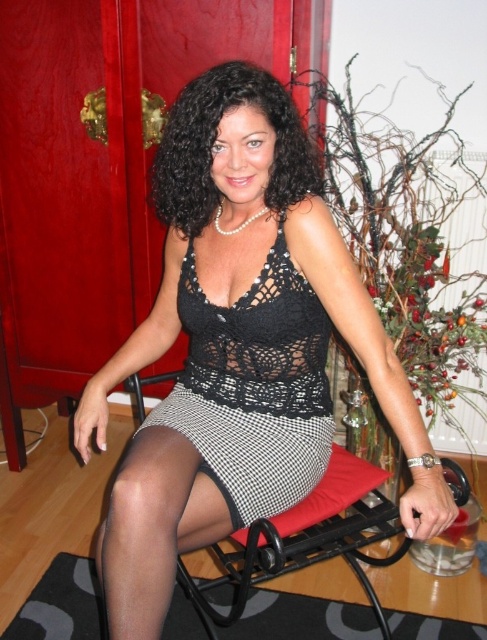
Who is higher up, black lace dress at center or black curly hair at center?

black curly hair at center is above.

What do you see at coordinates (254, 387) in the screenshot? I see `black lace dress at center` at bounding box center [254, 387].

Where is `black lace dress at center`? black lace dress at center is located at coordinates (254, 387).

What do you see at coordinates (300, 618) in the screenshot?
I see `black textured mat at lower left` at bounding box center [300, 618].

Is the position of black textured mat at lower left less distant than that of black houndstooth skirt at center?

That is False.

Between point (262, 618) and point (146, 420), which one is positioned in front?

Point (146, 420) is more forward.

You are a GUI agent. You are given a task and a screenshot of the screen. Output one action in this format:
    pyautogui.click(x=<x>, y=<y>)
    Task: Click on the black textured mat at lower left
    
    Given the screenshot: What is the action you would take?
    pyautogui.click(x=300, y=618)

Which is behind, point (336, 250) or point (294, 131)?

The point (336, 250) is more distant.

Is black lace top at center smaller than black curly hair at center?

No.

Between point (275, 96) and point (281, 177), which one is positioned in front?

Point (275, 96) is more forward.

Find the location of a particular element. The width and height of the screenshot is (487, 640). black lace top at center is located at coordinates (240, 348).